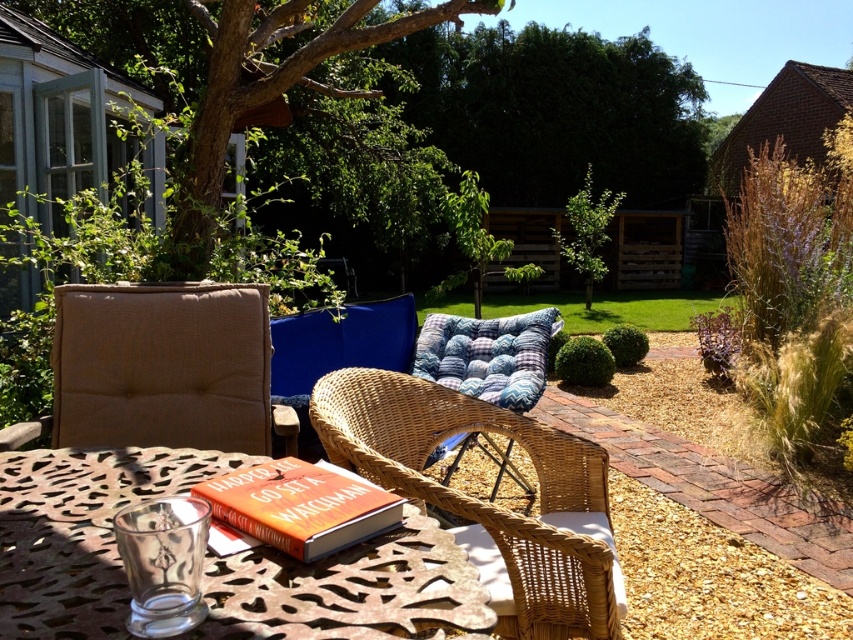
Is metallic glass at center taller than woven wicker armchair at center?

Incorrect, metallic glass at center's height is not larger of woven wicker armchair at center's.

Which is below, metallic glass at center or woven wicker armchair at center?

woven wicker armchair at center

Image resolution: width=853 pixels, height=640 pixels. Find the location of `metallic glass at center`. metallic glass at center is located at coordinates (80, 531).

Find the location of a particular element. metallic glass at center is located at coordinates tap(80, 531).

Which is above, hardcover book at center or green leafy tree at center?

green leafy tree at center is above.

Measure the distance between hardcover book at center and green leafy tree at center.

The distance of hardcover book at center from green leafy tree at center is 13.29 meters.

Where is `hardcover book at center`? hardcover book at center is located at coordinates (296, 508).

Can you confirm if metallic glass at center is taller than green leafy tree at upper left?

In fact, metallic glass at center may be shorter than green leafy tree at upper left.

You are a GUI agent. You are given a task and a screenshot of the screen. Output one action in this format:
    pyautogui.click(x=<x>, y=<y>)
    Task: Click on the metallic glass at center
    
    Given the screenshot: What is the action you would take?
    pyautogui.click(x=80, y=531)